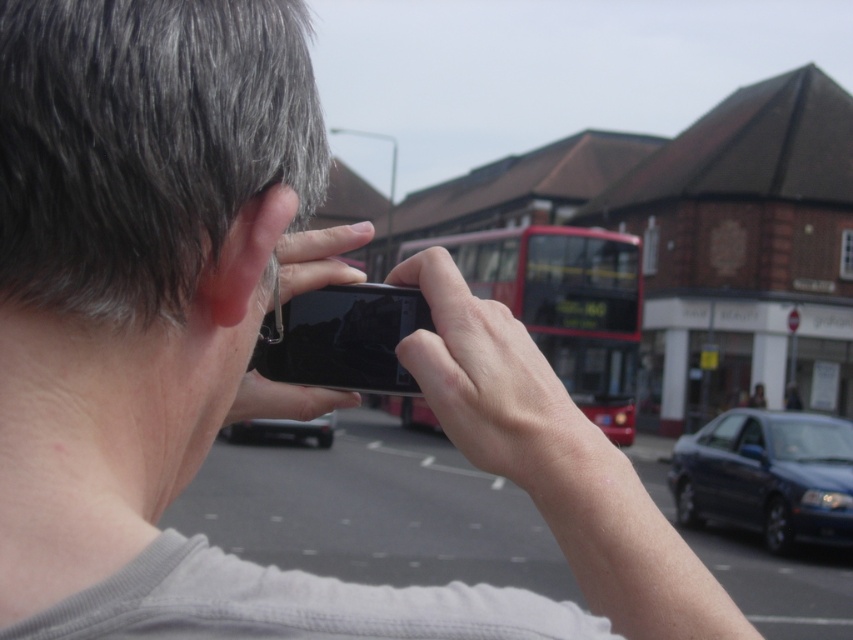
Looking at this image, you are a photographer trying to capture a photo of the shiny black car at center without including the smooth skin hand at center in the frame. Based on their sizes, is it possible to do so?

The smooth skin hand at center is shorter than the shiny black car at center, so it is possible to capture the shiny black car at center without including the smooth skin hand at center by adjusting the camera angle to focus on the larger object.

You are a photographer trying to capture the scene with the smooth skin hand at center and the black matte phone at center. Which object should you position to the left side of your frame to ensure the natural placement of both objects?

You should position the black matte phone at center to the left side of your frame because the smooth skin hand at center is to the right of it, ensuring both objects are naturally placed.